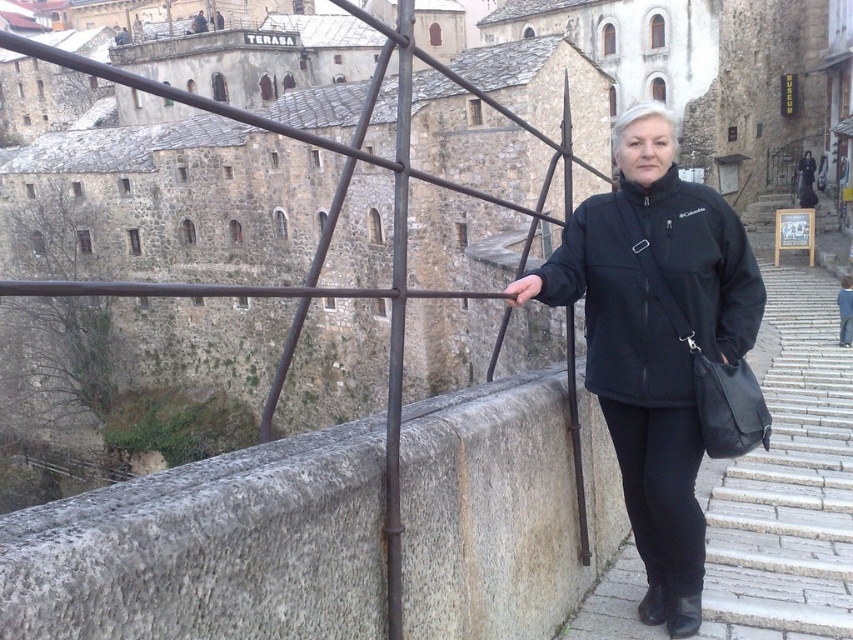
In the scene shown: You are a photographer standing on the gray stone stairs at lower right, and you want to take a photo of the black softshell jacket at center. Since you need to adjust your position to frame the jacket properly, can you estimate whether the jacket is narrower than the stairs?

The black softshell jacket at center is narrower than the gray stone stairs at lower right, so yes, the jacket is narrower than the stairs.

Based on the photo, A photographer wants to take a picture of the point at coordinates (651, 243) and another point that is 32.03 meters away. Given that the bridge is 50 meters long, can the photographer capture both points in a single frame if their camera has a 60 meter field of view?

Yes, the photographer can capture both points in a single frame because the distance between them is 32.03 meters, which is within the camera field of view of 60 meters.